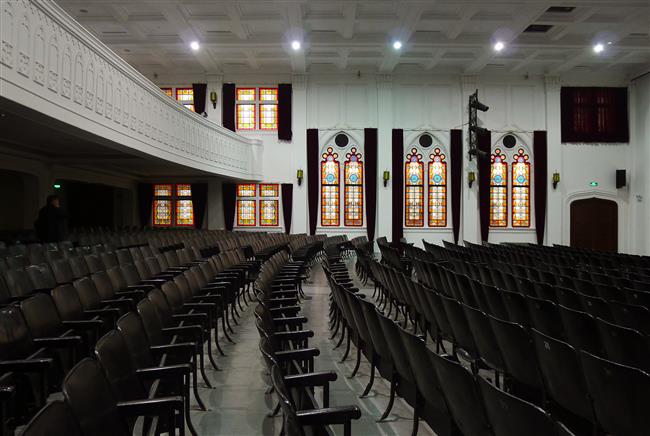
Identify the location of exit signs. The height and width of the screenshot is (436, 650). (56, 185), (591, 184).